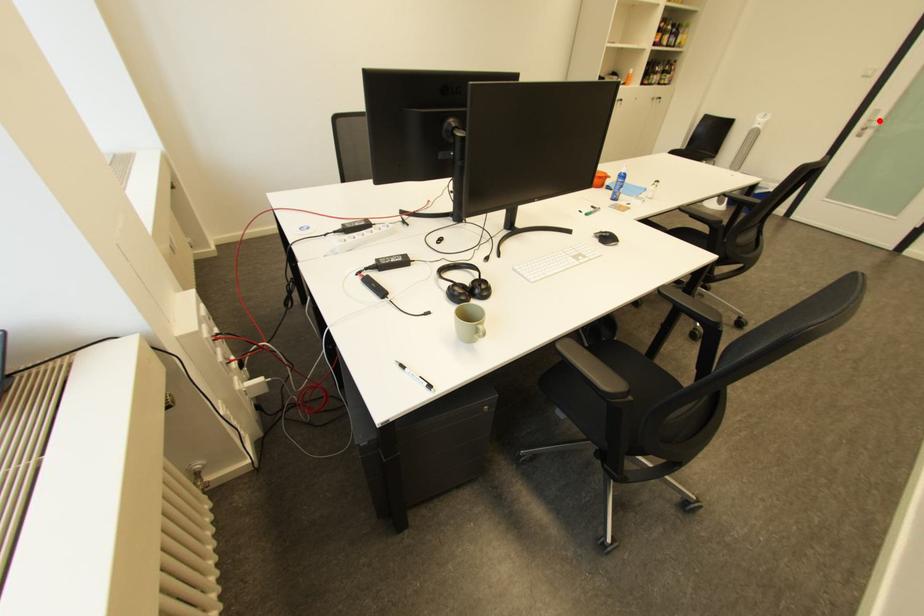
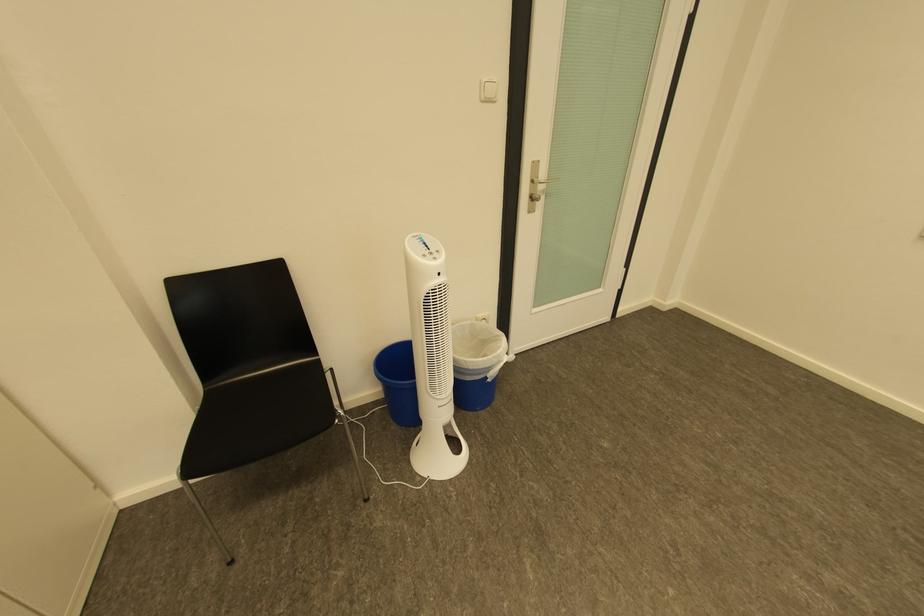
Locate, in the second image, the point that corresponds to the highlighted location in the first image.

(541, 182)